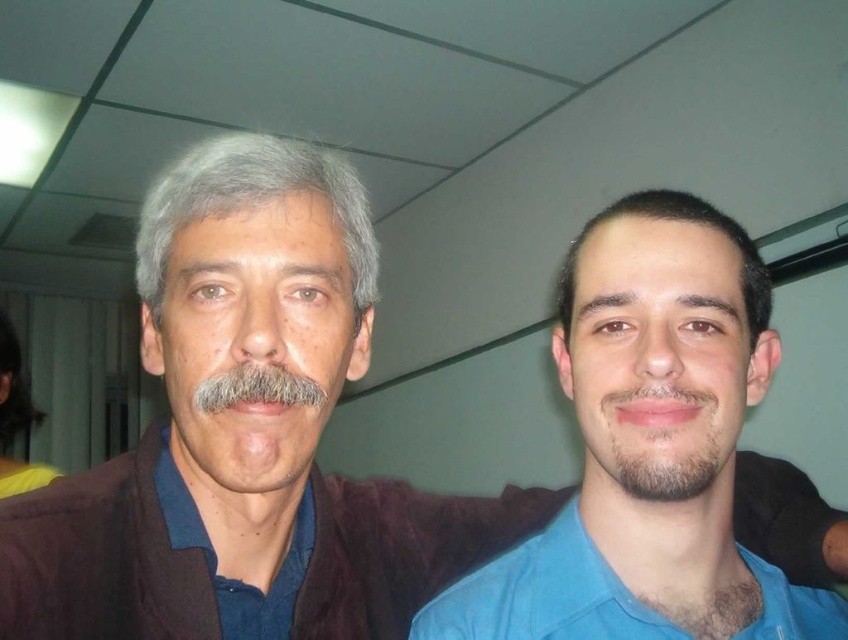
Question: Is blue cotton shirt at center to the left of dark brown hair at center from the viewer's perspective?

Choices:
 (A) no
 (B) yes

Answer: (B)

Question: Which of the following is the farthest from the observer?

Choices:
 (A) (174, 227)
 (B) (12, 358)
 (C) (194, 532)
 (D) (590, 477)

Answer: (B)

Question: Which of these objects is positioned farthest from the blue cotton shirt at center?

Choices:
 (A) gray matte hair at upper left
 (B) beige matte face at center

Answer: (A)

Question: Can you confirm if beige matte face at center is bigger than brown fuzzy beard at lower center?

Choices:
 (A) yes
 (B) no

Answer: (A)

Question: Which point is closer to the camera?

Choices:
 (A) (593, 499)
 (B) (742, 618)
 (C) (654, 483)
 (D) (260, 387)

Answer: (D)

Question: Is blue cotton shirt at right above brown fuzzy beard at lower center?

Choices:
 (A) yes
 (B) no

Answer: (A)